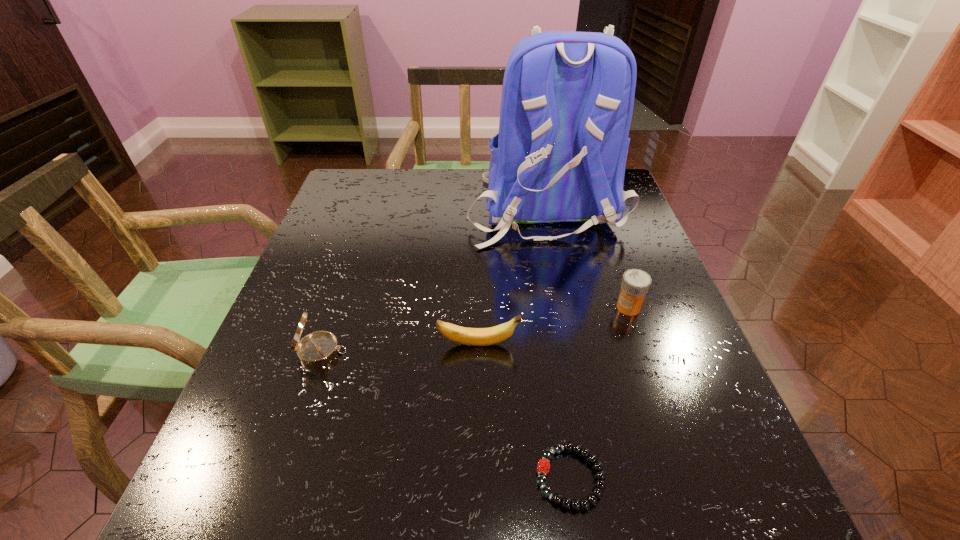
Locate an element on the screen. vacant space that satisfies the following two spatial constraints: 1. with the dial facing the bracelet; 2. on the right side of the compass is located at coordinates (279, 477).